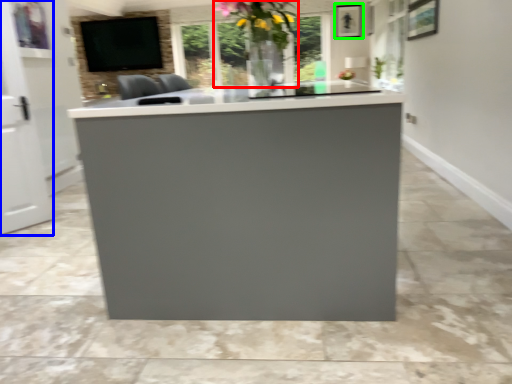
Question: Which object is positioned farthest from floral arrangement (highlighted by a red box)? Select from glass door (highlighted by a blue box) and picture frame (highlighted by a green box).

Choices:
 (A) glass door
 (B) picture frame

Answer: (B)